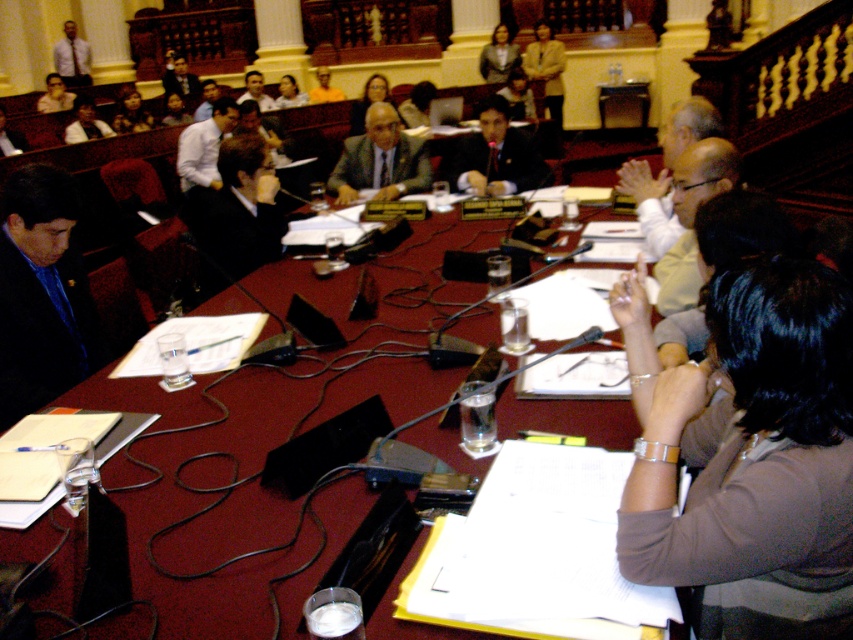
You are attending a formal meeting and need to locate two attendees based on their clothing. The dark brown suit at center and the light brown textured blazer at upper center are both present. Which attendee is sitting closer to the front of the table?

The dark brown suit at center is sitting closer to the front of the table because it is positioned below the light brown textured blazer at upper center, indicating it is lower in the visual hierarchy and thus nearer to the front.

You are a photographer who needs to capture a group photo of the matte black suit at left and the matte gray blazer at upper center. Since you want to ensure both subjects are clearly visible, which one should you focus on first considering their sizes?

The matte black suit at left is bigger than the matte gray blazer at upper center, so you should focus on the matte black suit at left first to ensure its details are sharp and visible.

You are a participant in the meeting. You want to pass a document to the person at point (279, 250). Can you reach them without leaving your seat?

The distance between you and the person at point (279, 250) is 11.27 feet. Since this distance is greater than the typical arm reach of a person, you cannot reach them without leaving your seat.